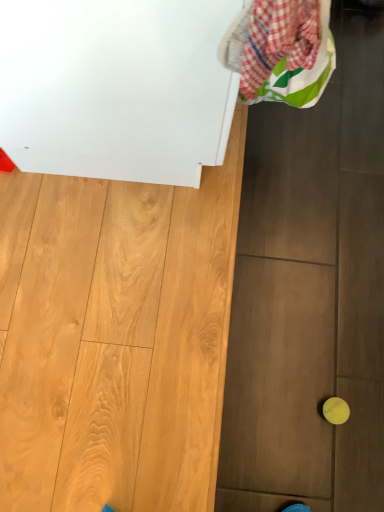
Locate an element on the screen. free area in between white glossy cabinet at upper left and yellow rubber ball at lower right is located at coordinates (235, 260).